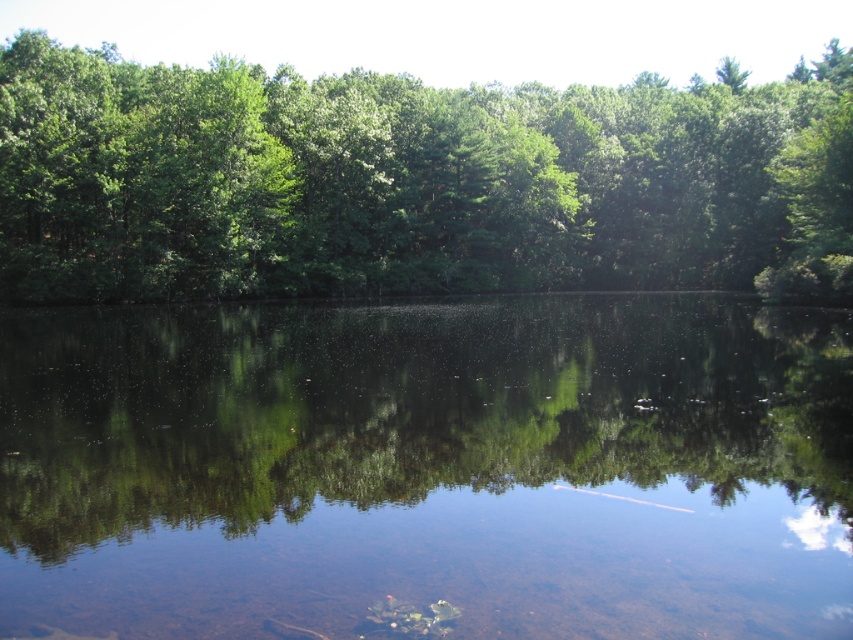
You are a bird flying over the serene natural scene. You see the clear water at center and the green leafy trees at upper center. Which object is positioned higher in the image?

The green leafy trees at upper center are positioned higher in the image than the clear water at center.

Consider the image. You are standing at the edge of the water in the scene. There is a clear water at center located at point (427, 468). If you want to reach the clear water at center, in which direction should you move from your current position?

The clear water at center is located at point (427, 468), so you should move towards the center of the water to reach it.